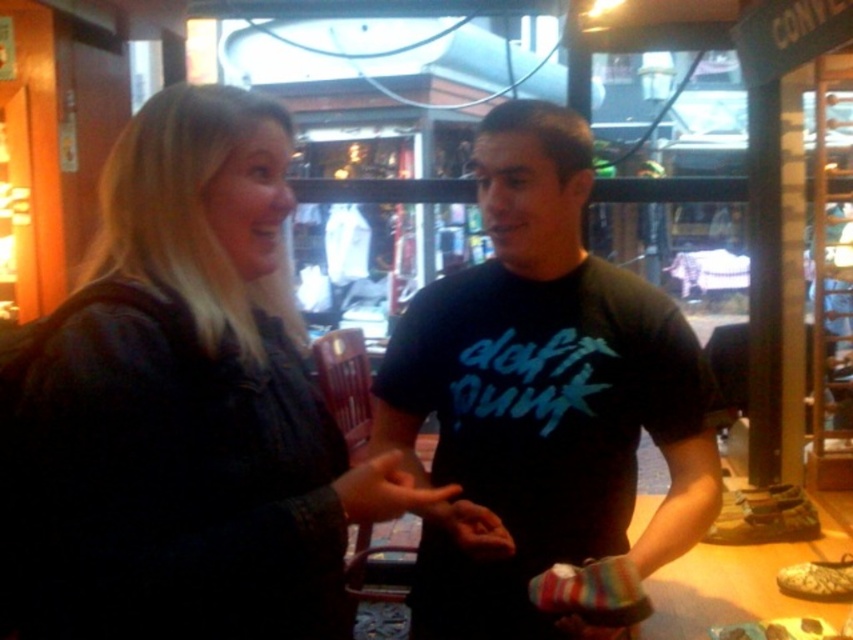
Question: From the image, what is the correct spatial relationship of leather jacket at left in relation to smooth leather hand at center?

Choices:
 (A) left
 (B) right

Answer: (A)

Question: From the image, what is the correct spatial relationship of black matte t-shirt at center in relation to multicolored fabric glove at center?

Choices:
 (A) left
 (B) right

Answer: (B)

Question: Which object appears farthest from the camera in this image?

Choices:
 (A) black matte t-shirt at center
 (B) smooth leather hand at center
 (C) multicolored fabric glove at center
 (D) leather jacket at left

Answer: (C)

Question: Which of these objects is positioned closest to the black matte t-shirt at center?

Choices:
 (A) multicolored fabric glove at center
 (B) leather jacket at left
 (C) smooth leather hand at center

Answer: (C)

Question: Which point is farther from the camera taking this photo?

Choices:
 (A) (509, 625)
 (B) (368, 518)
 (C) (502, 548)
 (D) (122, 628)

Answer: (A)

Question: Does leather jacket at left have a lesser width compared to black matte t-shirt at center?

Choices:
 (A) no
 (B) yes

Answer: (B)